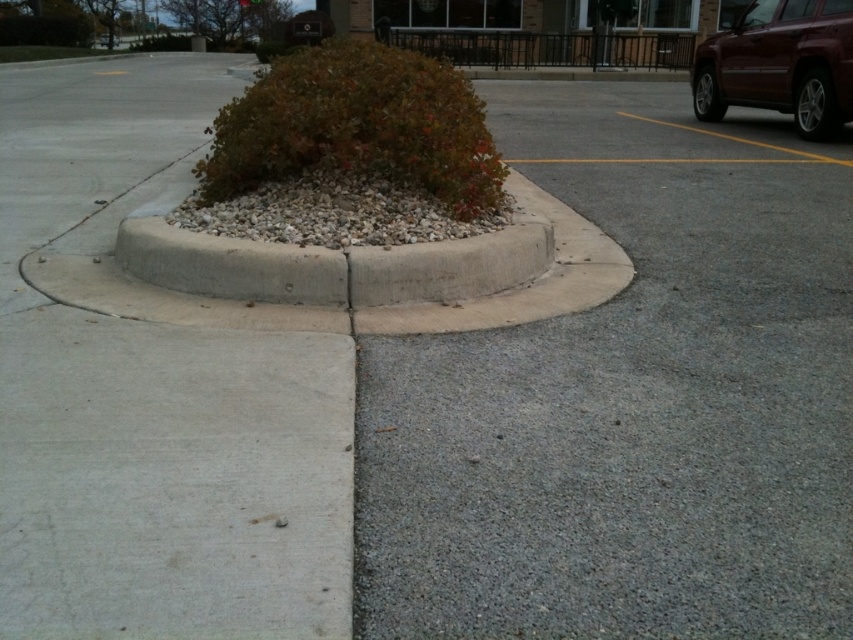
You are standing at the center of the parking lot and want to walk to the gray asphalt at lower right. According to the coordinates provided, in which direction should you head from your current position?

The gray asphalt at lower right is located at coordinates point (630, 400), so you should head towards the lower right direction from your current position.

You are a gardener planning to place a new decorative stone path in the parking lot. The path must be placed either on the gray asphalt at lower right or the green leafy bush at center. Which location has more space to accommodate the path?

The gray asphalt at lower right has more space to accommodate the path since it is bigger than the green leafy bush at center.